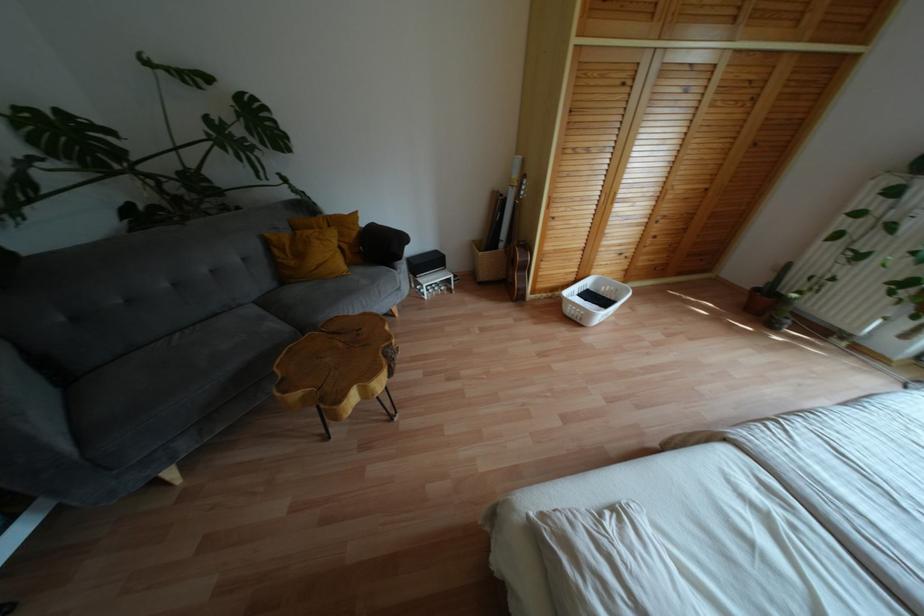
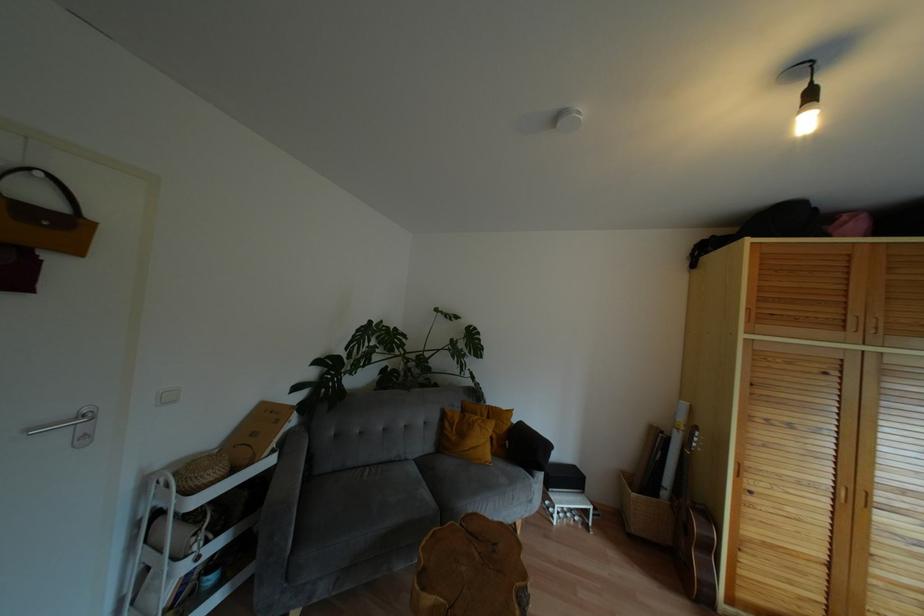
Where in the second image is the point corresponding to [380,246] from the first image?

(524, 448)